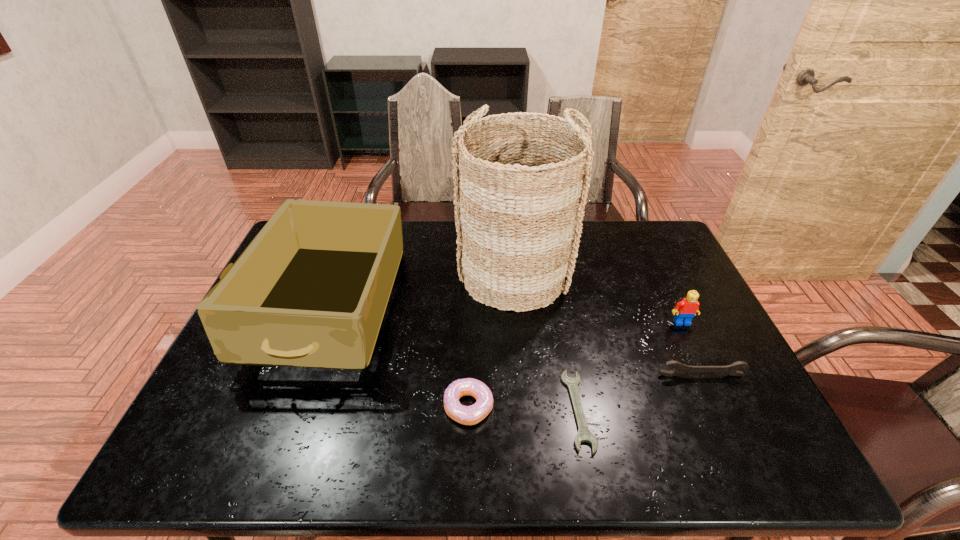
Find the location of a particular element. free space located 0.380m on the face of the Lego is located at coordinates (745, 457).

The image size is (960, 540). I want to click on vacant region located 0.120m on the open ends of the right wrench, so click(x=721, y=420).

I want to click on free space located 0.220m on the back of the doughnut, so click(x=470, y=321).

Image resolution: width=960 pixels, height=540 pixels. What are the coordinates of `vacant space located 0.400m on the back of the shorter wrench` in the screenshot? It's located at (552, 270).

You are a GUI agent. You are given a task and a screenshot of the screen. Output one action in this format:
    pyautogui.click(x=<x>, y=<y>)
    Task: Click on the basket present at the far edge
    
    Given the screenshot: What is the action you would take?
    pyautogui.click(x=520, y=196)

Where is `box that is at the far edge`? The image size is (960, 540). box that is at the far edge is located at coordinates (311, 290).

This screenshot has width=960, height=540. I want to click on object that is at the near edge, so click(x=584, y=435).

Image resolution: width=960 pixels, height=540 pixels. I want to click on object that is at the left edge, so click(311, 290).

At what (x,y) coordinates should I click in order to perform the action: click on Lego that is positioned at the right edge. Please return your answer as a coordinate pair (x, y). The image size is (960, 540). Looking at the image, I should click on (686, 309).

At what (x,y) coordinates should I click in order to perform the action: click on wrench that is at the right edge. Please return your answer as a coordinate pair (x, y). This screenshot has width=960, height=540. Looking at the image, I should click on (732, 369).